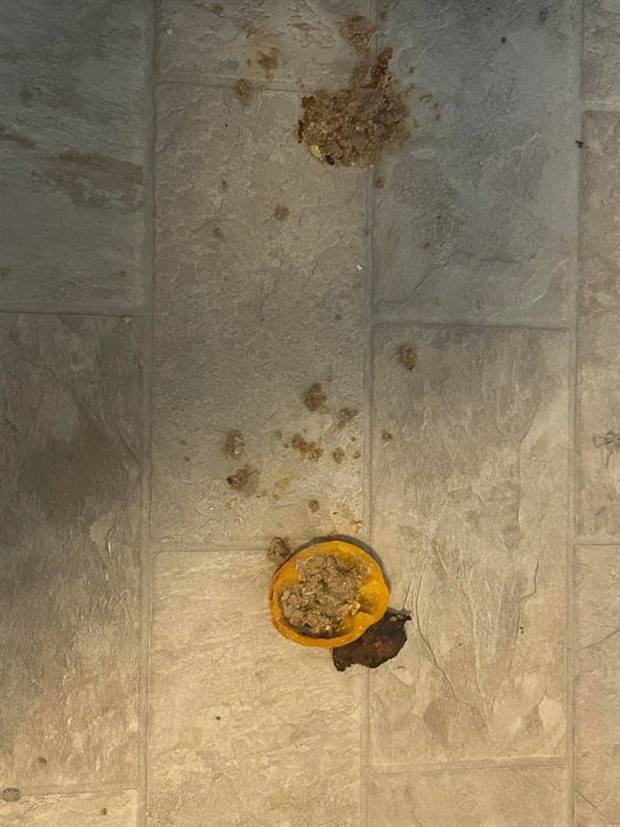
Locate an element on the screen. This screenshot has width=620, height=827. grout line is located at coordinates (568, 663).